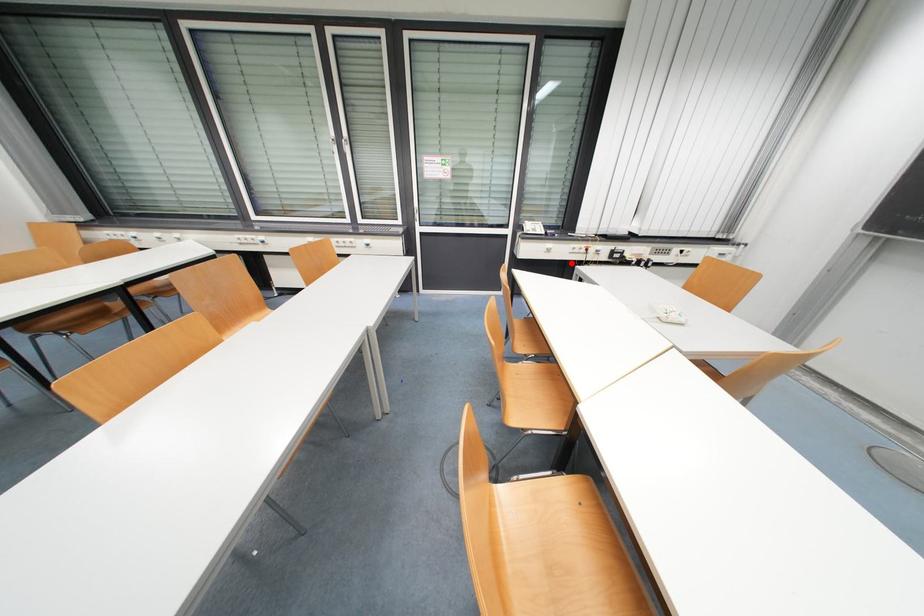
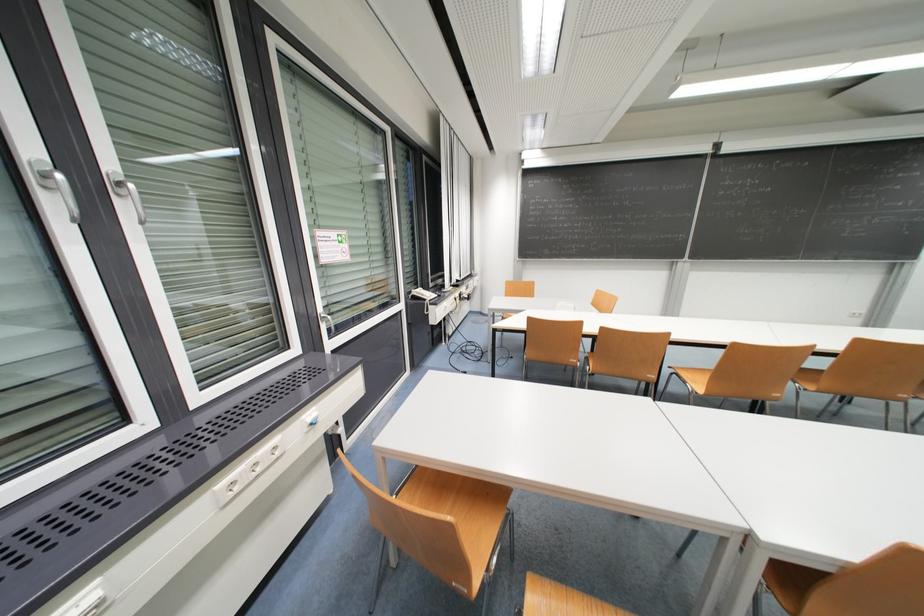
Question: I am providing you with two images of the same scene from different viewpoints. A red point is marked on the first image. Is the red point's position out of view in image 2?

Choices:
 (A) Yes
 (B) No

Answer: (A)